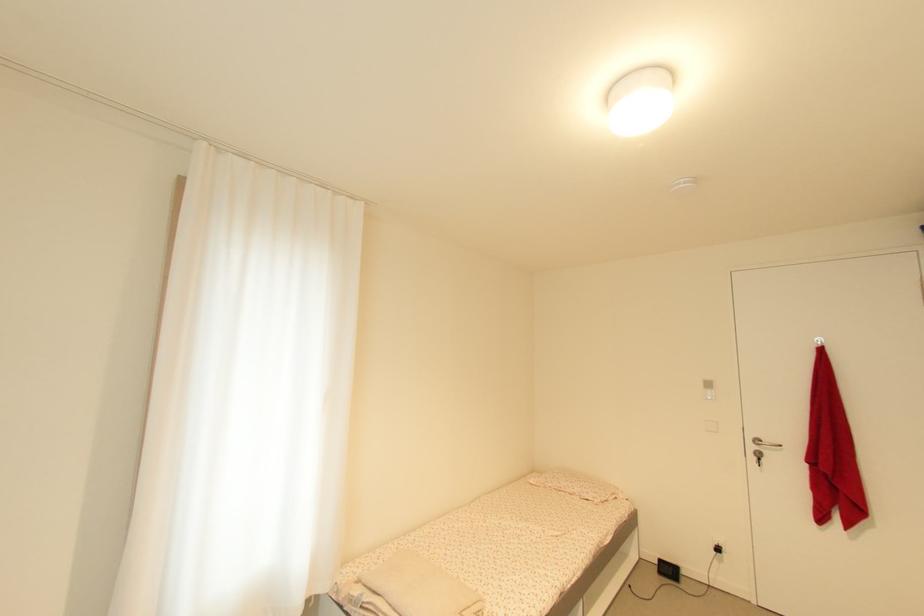
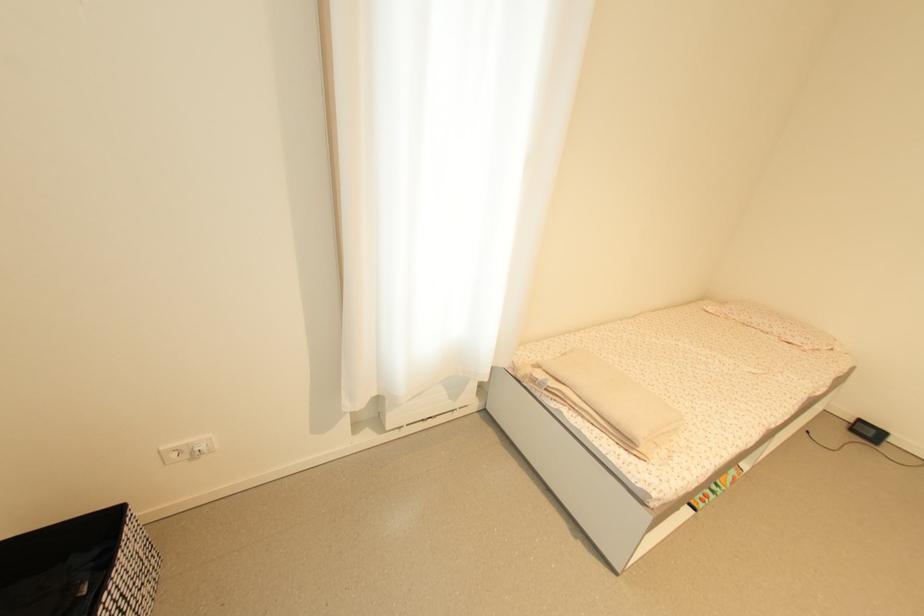
The images are taken continuously from a first-person perspective. In which direction is your viewpoint rotating?

The camera's rotation is toward left-down.